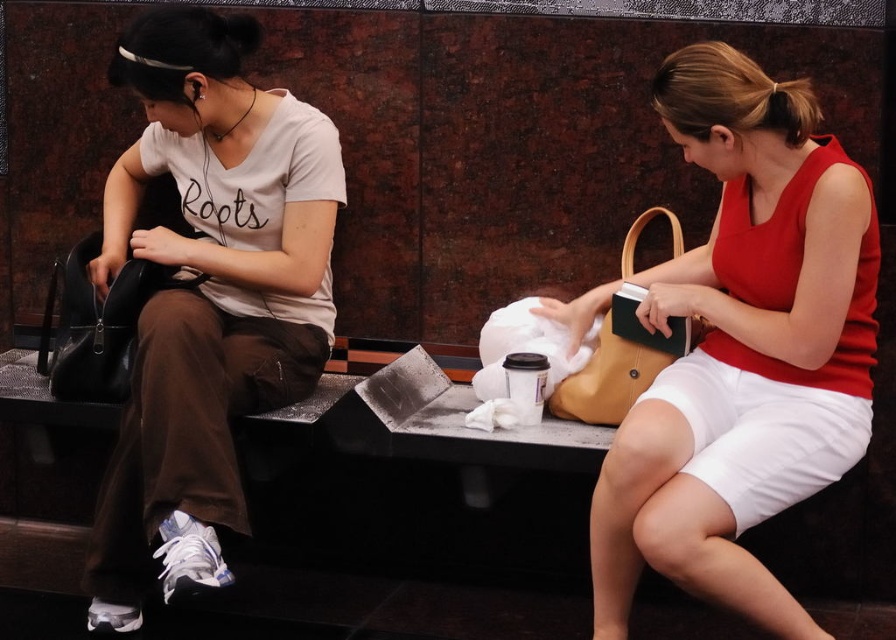
You are a fashion designer observing two purses in the scene. The matte yellow purse at right and the matte brown handbag at right. Which one is wider?

The matte yellow purse at right is wider than the matte brown handbag at right according to the description.

You are standing at the entrance of the subway station and see two points marked in the scene. The first point is at coordinates point (164,499) and the second is at point (617,396). Which point is closer to you?

Point (164,499) is in front of point (617,396), so it is closer to you.

You are a security guard at the transit station. You need to determine if the matte black purse at left can fit into a storage locker that is 10 cm wider than the matte brown handbag at right. Can it fit?

The matte black purse at left might be wider than the matte brown handbag at right, so if the locker is 10 cm wider than the handbag, it depends on the exact width difference. However, since the purse might be wider, it could potentially fit if the locker accommodates its maximum width.